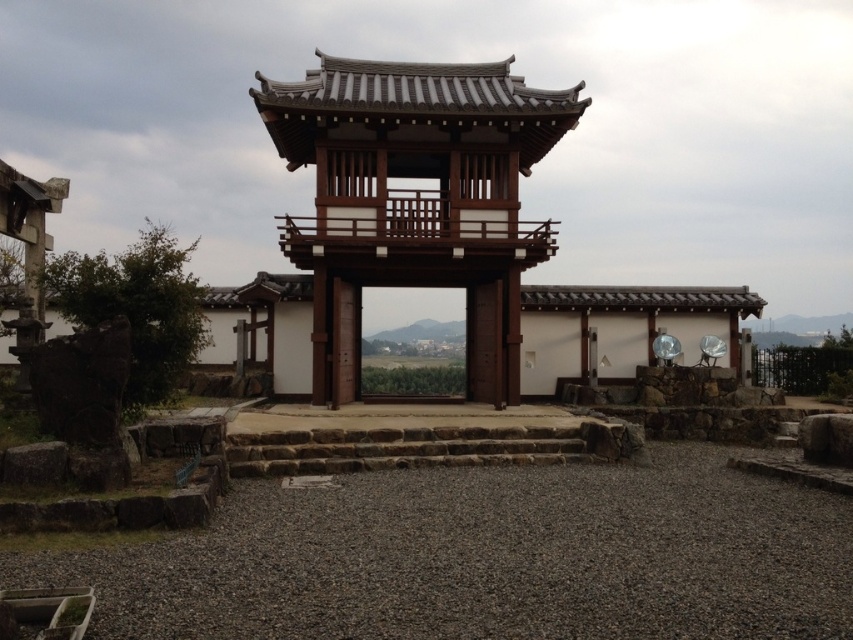
You are standing in front of the traditional Japanese gate and want to place a small decoration between the two points, point (102, 636) and point (442, 124). Which point should you place it closer to in order for it to be more visible to visitors approaching from the front?

You should place the decoration closer to point (102, 636) because it is closer to the viewer, making it more visible to visitors approaching from the front.